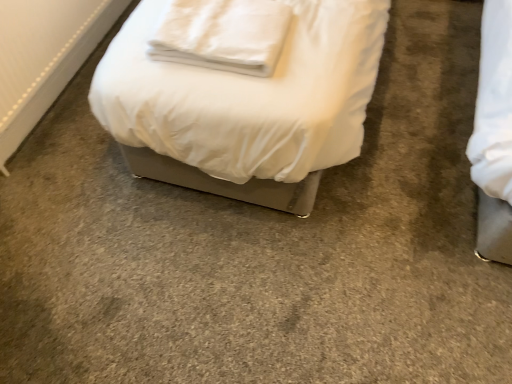
Question: Relative to white fabric radiator at lower left, is white soft pillow at upper center in front or behind?

Choices:
 (A) front
 (B) behind

Answer: (A)

Question: From the image's perspective, is white soft pillow at upper center positioned above or below white fabric radiator at lower left?

Choices:
 (A) below
 (B) above

Answer: (A)

Question: Is white soft pillow at upper center to the left or to the right of white fabric radiator at lower left in the image?

Choices:
 (A) right
 (B) left

Answer: (A)

Question: Is point (29, 14) closer or farther from the camera than point (246, 18)?

Choices:
 (A) farther
 (B) closer

Answer: (A)

Question: Is white fabric radiator at lower left inside or outside of white soft pillow at upper center?

Choices:
 (A) outside
 (B) inside

Answer: (A)

Question: From a real-world perspective, is white fabric radiator at lower left physically located above or below white soft pillow at upper center?

Choices:
 (A) below
 (B) above

Answer: (A)

Question: Relative to white soft pillow at upper center, is white fabric radiator at lower left in front or behind?

Choices:
 (A) front
 (B) behind

Answer: (B)